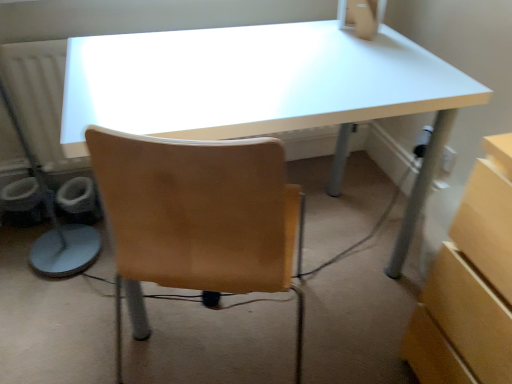
The height and width of the screenshot is (384, 512). In order to click on vacant region to the left of matte beige desktop computer at upper center in this screenshot , I will do `click(307, 40)`.